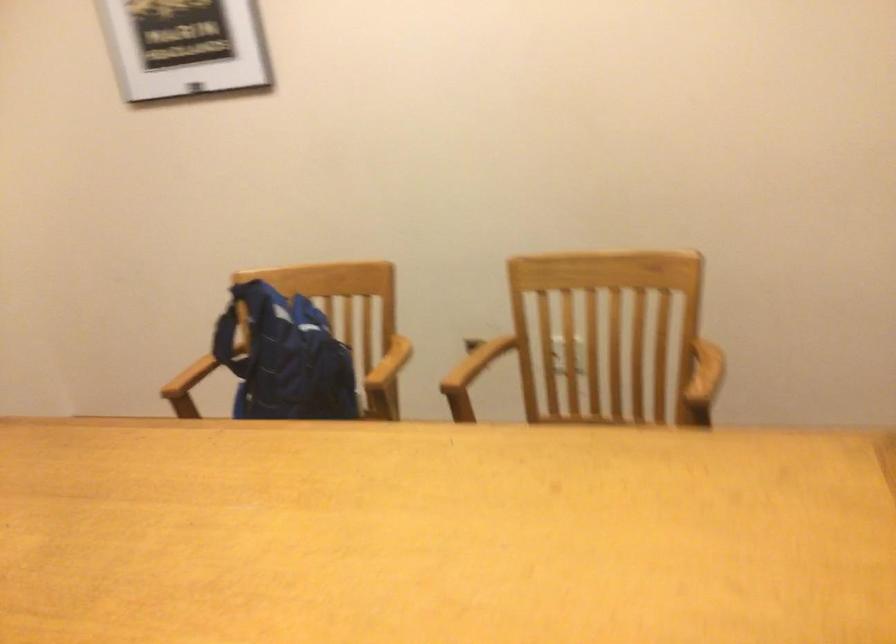
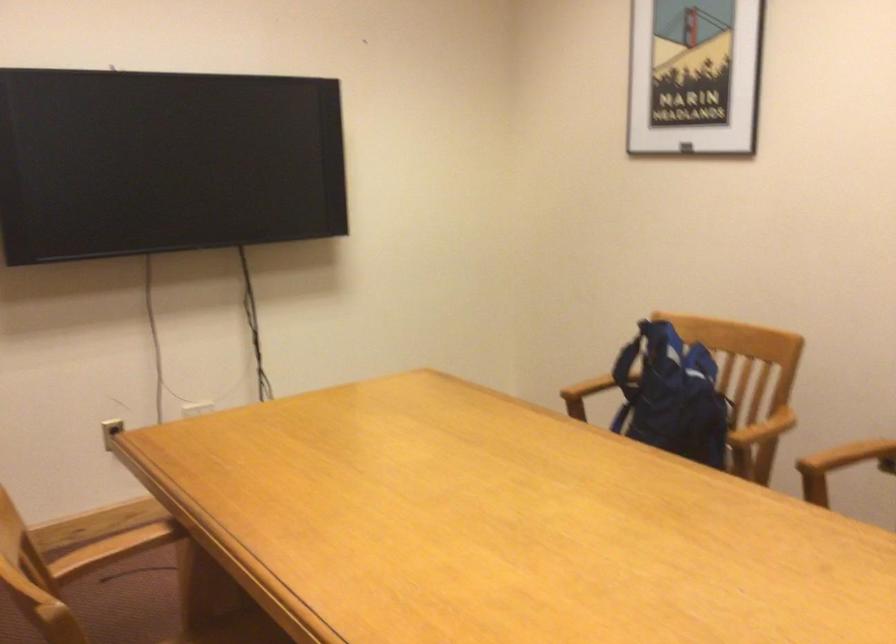
Where in the second image is the point corresponding to [398,353] from the first image?

(763, 428)